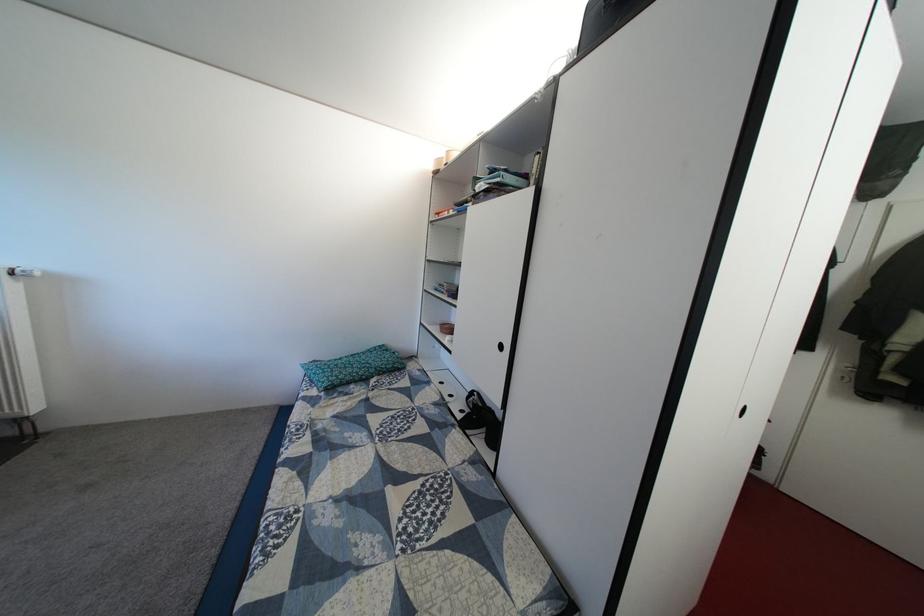
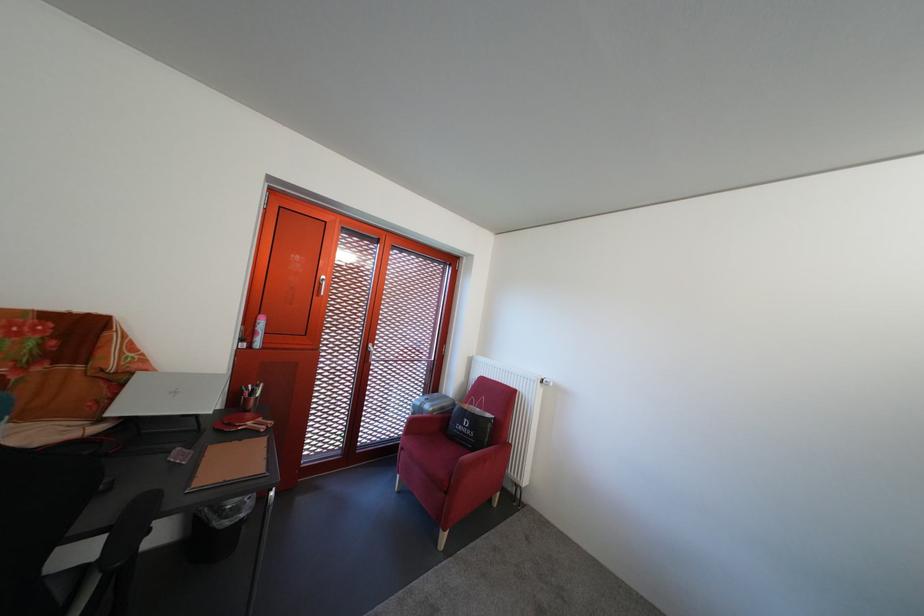
Question: How did the camera likely rotate?

Choices:
 (A) Left
 (B) Right
 (C) Up
 (D) Down

Answer: (A)